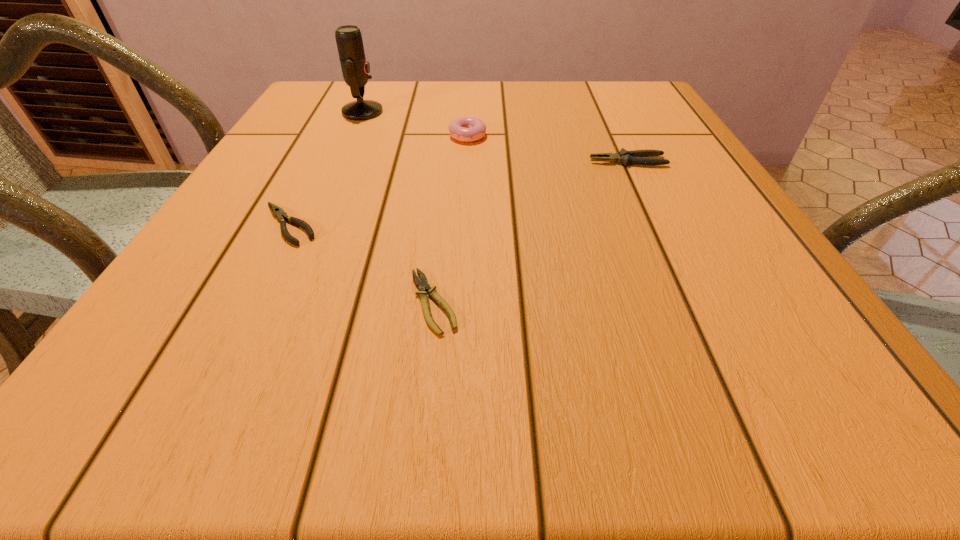
Choose which pliers is the second nearest neighbor to the rightmost object. Please provide its 2D coordinates. Your answer should be formatted as a tuple, i.e. [(x, y)], where the tuple contains the x and y coordinates of a point satisfying the conditions above.

[(278, 212)]

Select which pliers appears as the third closest to the tallest object. Please provide its 2D coordinates. Your answer should be formatted as a tuple, i.e. [(x, y)], where the tuple contains the x and y coordinates of a point satisfying the conditions above.

[(422, 284)]

Locate an element on the screen. free space that satisfies the following two spatial constraints: 1. on the back side of the nearest pliers; 2. on the right side of the doughnut is located at coordinates (451, 134).

Where is `free location that satisfies the following two spatial constraints: 1. on the side of the shortest pliers with the red ring; 2. on the right side of the tallest object`? Image resolution: width=960 pixels, height=540 pixels. free location that satisfies the following two spatial constraints: 1. on the side of the shortest pliers with the red ring; 2. on the right side of the tallest object is located at coordinates (277, 302).

Identify the location of vacant space that satisfies the following two spatial constraints: 1. at the gripping part of the farthest pliers; 2. on the front side of the nearest object. (694, 302).

Identify the location of vacant region that satisfies the following two spatial constraints: 1. on the side of the microphone with the red ring; 2. on the front side of the second shortest pliers. (312, 224).

Locate an element on the screen. The image size is (960, 540). vacant area in the image that satisfies the following two spatial constraints: 1. at the gripping part of the farthest pliers; 2. on the front side of the nearest object is located at coordinates (694, 302).